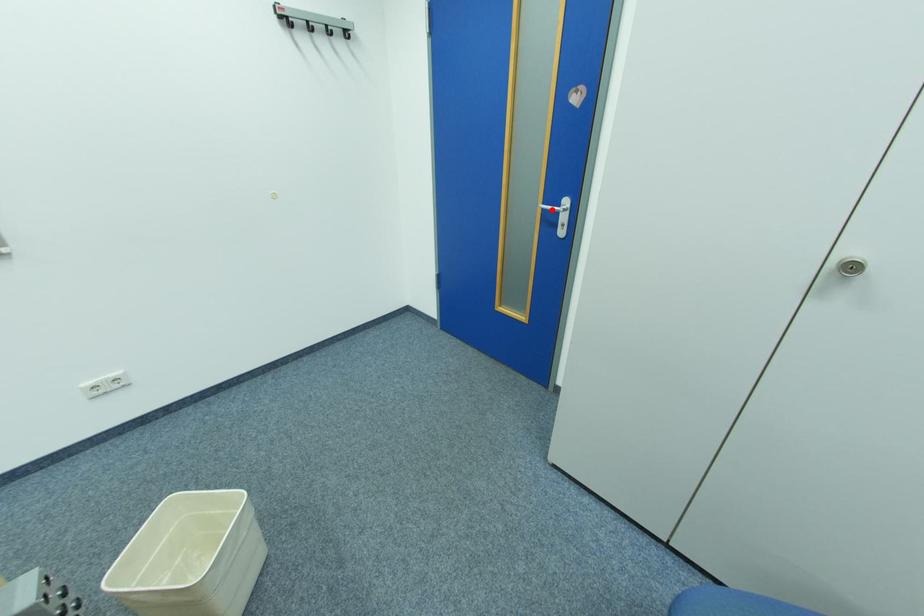
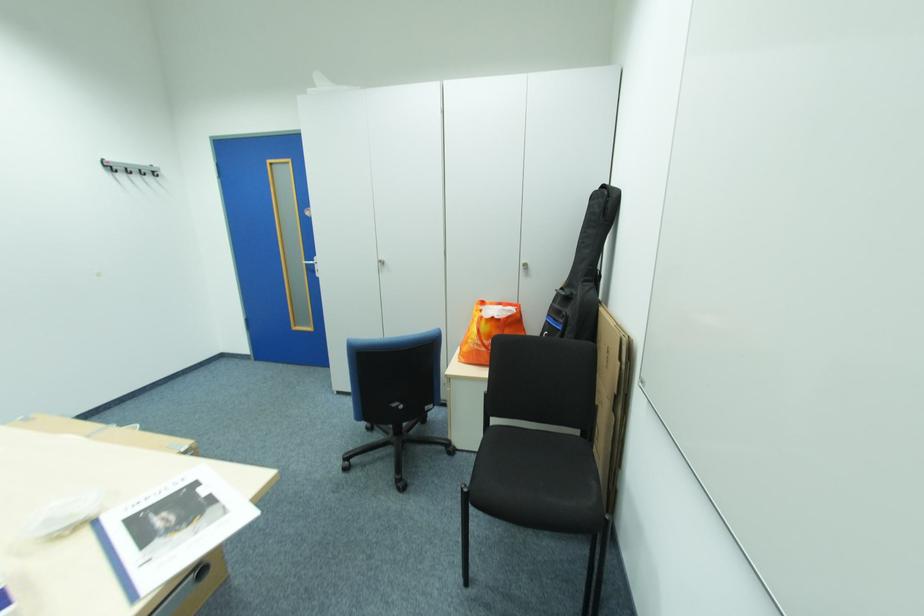
In the second image, find the point that corresponds to the highlighted location in the first image.

(314, 265)